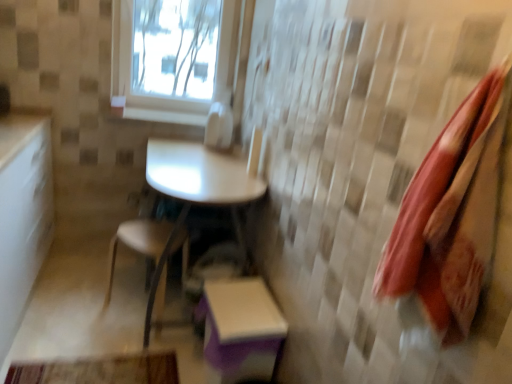
Locate an element on the screen. This screenshot has width=512, height=384. free space above white glossy table at center (from a real-world perspective) is located at coordinates (209, 169).